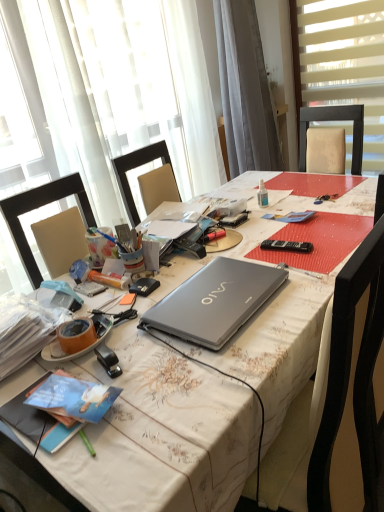
Question: Is matte plastic pencil at center-left far away from metallic silver laptop at center?

Choices:
 (A) yes
 (B) no

Answer: (B)

Question: Could you tell me if matte plastic pencil at center-left is turned towards metallic silver laptop at center?

Choices:
 (A) no
 (B) yes

Answer: (A)

Question: Could metallic silver laptop at center be considered to be inside matte plastic pencil at center-left?

Choices:
 (A) yes
 (B) no

Answer: (B)

Question: From a real-world perspective, is matte plastic pencil at center-left on metallic silver laptop at center?

Choices:
 (A) yes
 (B) no

Answer: (A)

Question: Is the surface of matte plastic pencil at center-left in direct contact with metallic silver laptop at center?

Choices:
 (A) no
 (B) yes

Answer: (A)

Question: Visually, is metallic silver laptop at center positioned to the left or to the right of blue matte book at lower left, which ranks as the first book in bottom-to-top order?

Choices:
 (A) right
 (B) left

Answer: (A)

Question: From a real-world perspective, relative to blue matte book at lower left, which is counted as the 2th book, starting from the top, is metallic silver laptop at center vertically above or below?

Choices:
 (A) above
 (B) below

Answer: (B)

Question: Considering the positions of metallic silver laptop at center and blue matte book at lower left, which ranks as the first book in bottom-to-top order, in the image, is metallic silver laptop at center bigger or smaller than blue matte book at lower left, which ranks as the first book in bottom-to-top order,?

Choices:
 (A) small
 (B) big

Answer: (B)

Question: Is metallic silver laptop at center in front of or behind blue matte book at lower left, which is counted as the 2th book, starting from the top, in the image?

Choices:
 (A) behind
 (B) front

Answer: (B)

Question: Is point (92, 280) positioned closer to the camera than point (309, 371)?

Choices:
 (A) farther
 (B) closer

Answer: (A)

Question: From a real-world perspective, relative to metallic silver laptop at center, is matte plastic pencil at center-left vertically above or below?

Choices:
 (A) below
 (B) above

Answer: (B)

Question: Visually, is matte plastic pencil at center-left positioned to the left or to the right of metallic silver laptop at center?

Choices:
 (A) right
 (B) left

Answer: (B)

Question: In the image, is matte plastic pencil at center-left positioned in front of or behind metallic silver laptop at center?

Choices:
 (A) behind
 (B) front

Answer: (A)

Question: Looking at their shapes, would you say gray fabric curtain at upper center is wider or thinner than clear plastic bottle at center?

Choices:
 (A) wide
 (B) thin

Answer: (A)

Question: Looking at the image, does gray fabric curtain at upper center seem bigger or smaller compared to clear plastic bottle at center?

Choices:
 (A) small
 (B) big

Answer: (B)